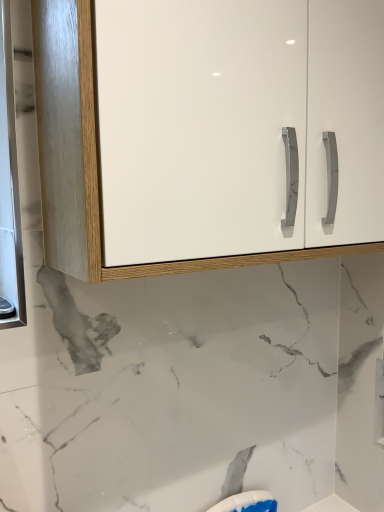
Question: Is white glossy medicine cabinet at left taller or shorter than white glossy cabinet at upper center?

Choices:
 (A) short
 (B) tall

Answer: (B)

Question: Considering the positions of point (4, 287) and point (137, 228), is point (4, 287) closer or farther from the camera than point (137, 228)?

Choices:
 (A) closer
 (B) farther

Answer: (B)

Question: Choose the correct answer: Is white glossy medicine cabinet at left inside white glossy cabinet at upper center or outside it?

Choices:
 (A) outside
 (B) inside

Answer: (A)

Question: From the image's perspective, relative to white glossy medicine cabinet at left, is white glossy cabinet at upper center above or below?

Choices:
 (A) above
 (B) below

Answer: (A)

Question: Considering the positions of point (188, 50) and point (13, 283), is point (188, 50) closer or farther from the camera than point (13, 283)?

Choices:
 (A) farther
 (B) closer

Answer: (B)

Question: Looking at their shapes, would you say white glossy cabinet at upper center is wider or thinner than white glossy medicine cabinet at left?

Choices:
 (A) wide
 (B) thin

Answer: (A)

Question: Is white glossy cabinet at upper center in front of or behind white glossy medicine cabinet at left in the image?

Choices:
 (A) front
 (B) behind

Answer: (A)